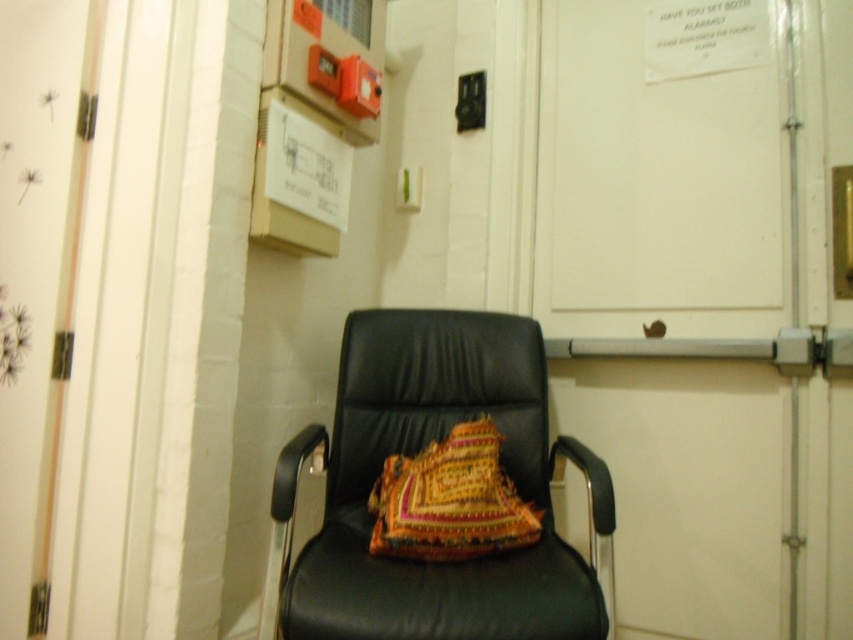
Is point (331, 556) less distant than point (476, 529)?

Yes, point (331, 556) is in front of point (476, 529).

Describe the element at coordinates (416, 451) in the screenshot. I see `black leather swivel chair at center` at that location.

Identify the location of black leather swivel chair at center. (416, 451).